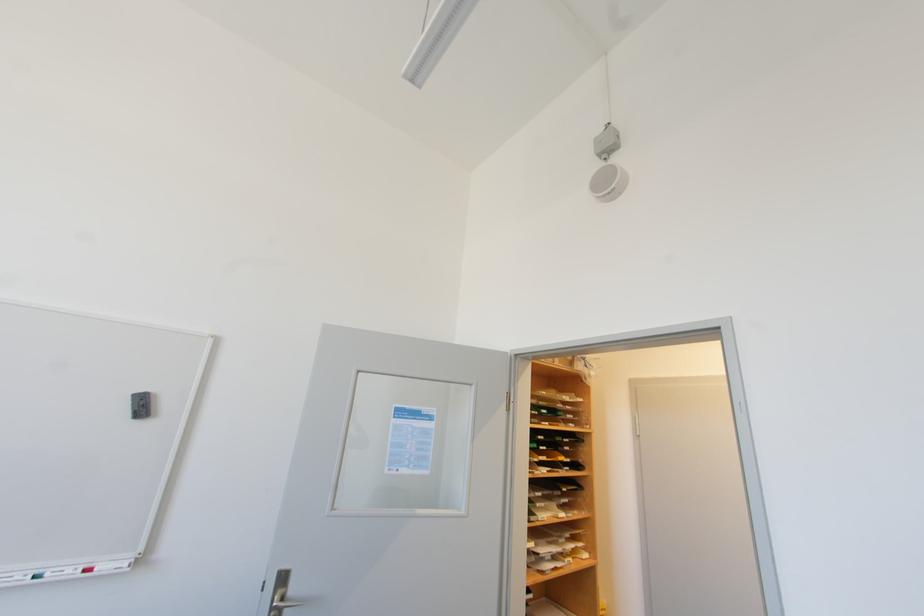
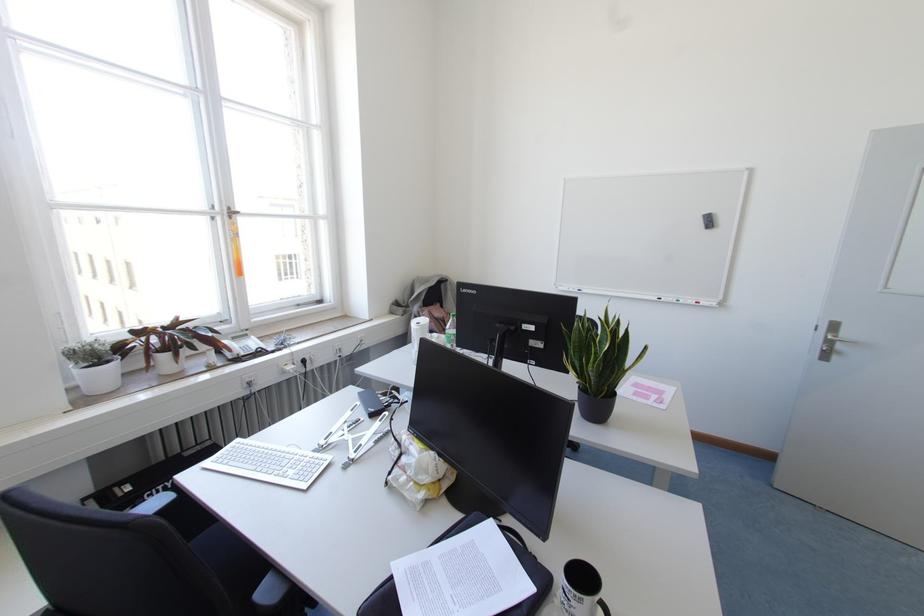
The point at (83, 570) is marked in the first image. Where is the corresponding point in the second image?

(696, 302)